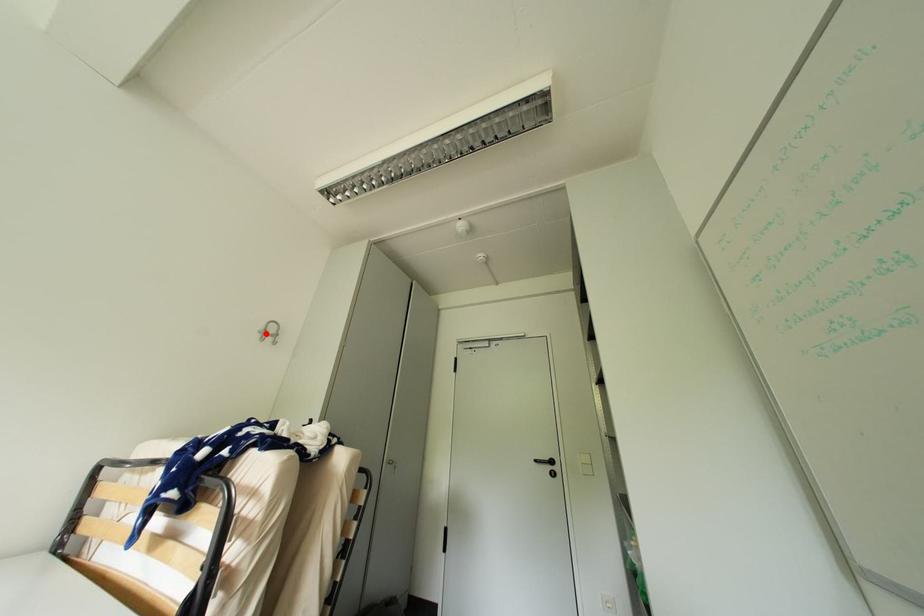
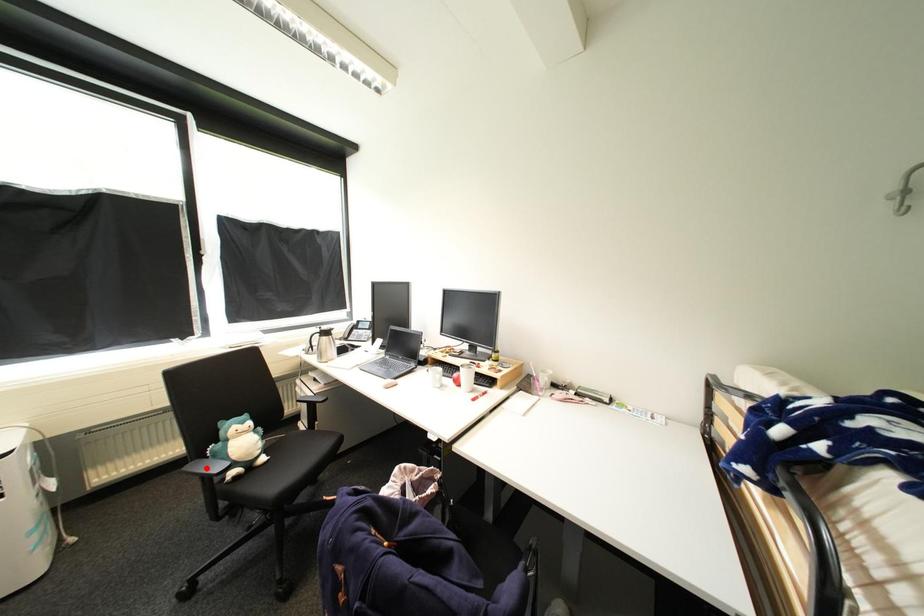
I am providing you with two images of the same scene from different viewpoints. A red point is marked on the first image and another point is marked on the second image. Do the highlighted points in image1 and image2 indicate the same real-world spot?

No